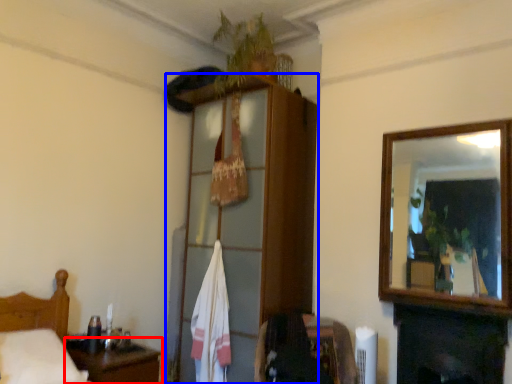
Question: Which object appears farthest to the camera in this image, table (highlighted by a red box) or dresser (highlighted by a blue box)?

Choices:
 (A) table
 (B) dresser

Answer: (B)